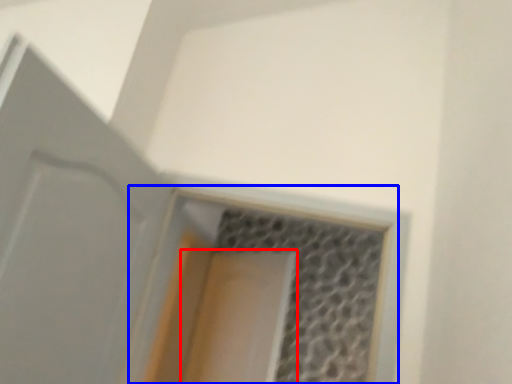
Question: Which of the following is the farthest to the observer, screen door (highlighted by a red box) or window (highlighted by a blue box)?

Choices:
 (A) screen door
 (B) window

Answer: (A)